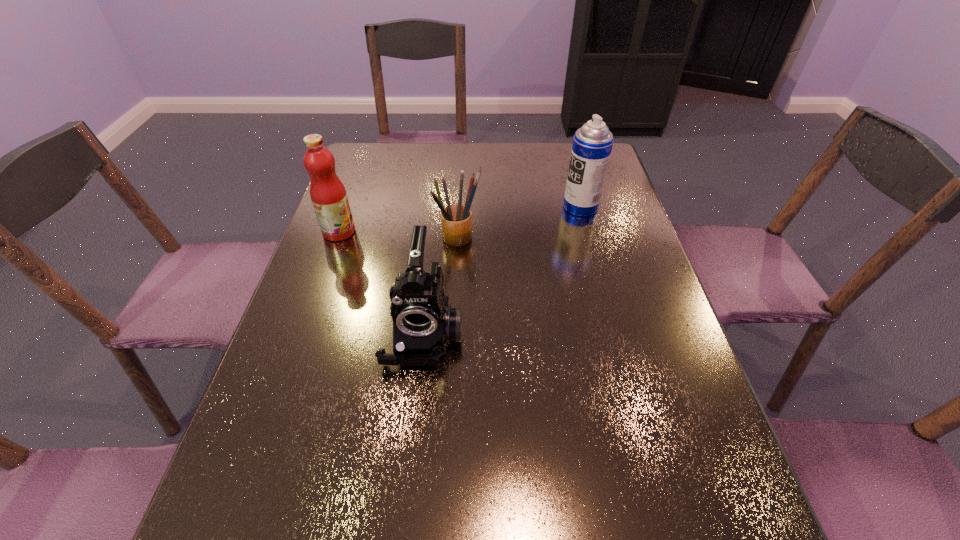
Where is `empty space between the pencil box and the fruit juice`? empty space between the pencil box and the fruit juice is located at coordinates (399, 235).

Find the location of a particular element. This screenshot has width=960, height=540. blank region between the leftmost object and the pencil box is located at coordinates (399, 235).

Locate an element on the screen. The width and height of the screenshot is (960, 540). object that is the closest one to the fruit juice is located at coordinates (456, 219).

You are a GUI agent. You are given a task and a screenshot of the screen. Output one action in this format:
    pyautogui.click(x=<x>, y=<y>)
    Task: Click on the third closest object relative to the rightmost object
    This screenshot has width=960, height=540.
    Given the screenshot: What is the action you would take?
    pyautogui.click(x=328, y=195)

Where is `free spot that satisfies the following two spatial constraints: 1. on the front label of the pencil box; 2. on the right side of the fruit juice`? free spot that satisfies the following two spatial constraints: 1. on the front label of the pencil box; 2. on the right side of the fruit juice is located at coordinates (337, 238).

Identify the location of vacant space that satisfies the following two spatial constraints: 1. on the label side of the farthest object; 2. on the front side of the pencil box. The height and width of the screenshot is (540, 960). (588, 238).

What are the coordinates of `vacant area that satisfies the following two spatial constraints: 1. on the label side of the farthest object; 2. on the lens mount of the camcorder` in the screenshot? It's located at (614, 334).